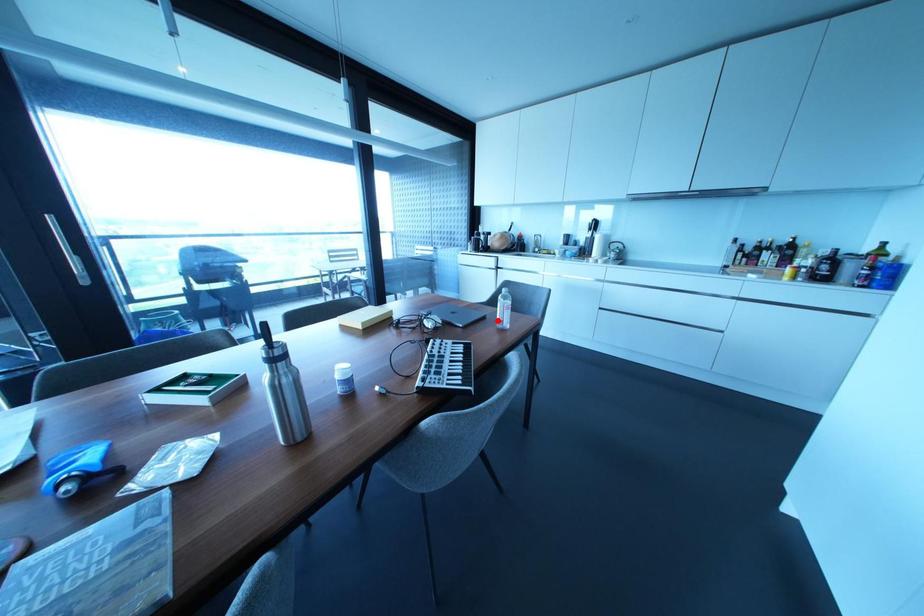
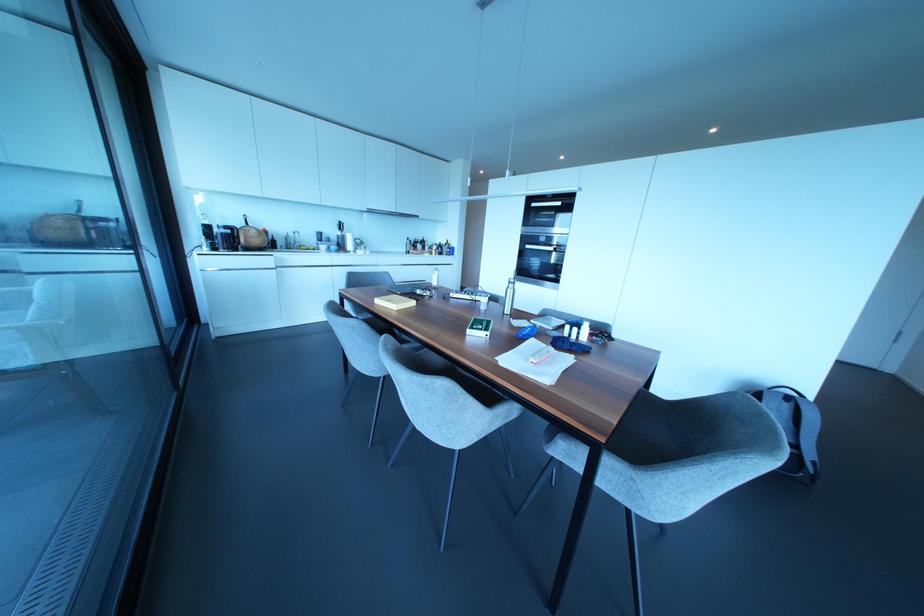
Where in the second image is the point corresponding to the highlighted location from the first image?

(434, 283)